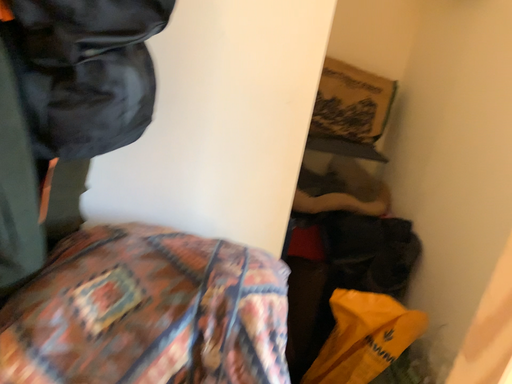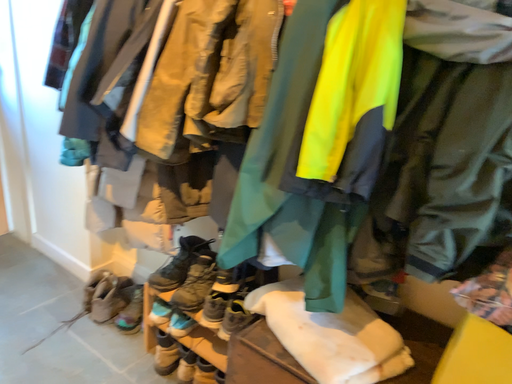
Question: How did the camera likely rotate when shooting the video?

Choices:
 (A) rotated left
 (B) rotated right

Answer: (A)